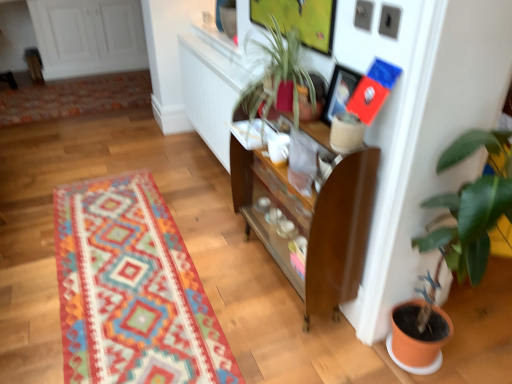
What are the coordinates of `space that is in front of brown wood cabinet at center` in the screenshot? It's located at (286, 336).